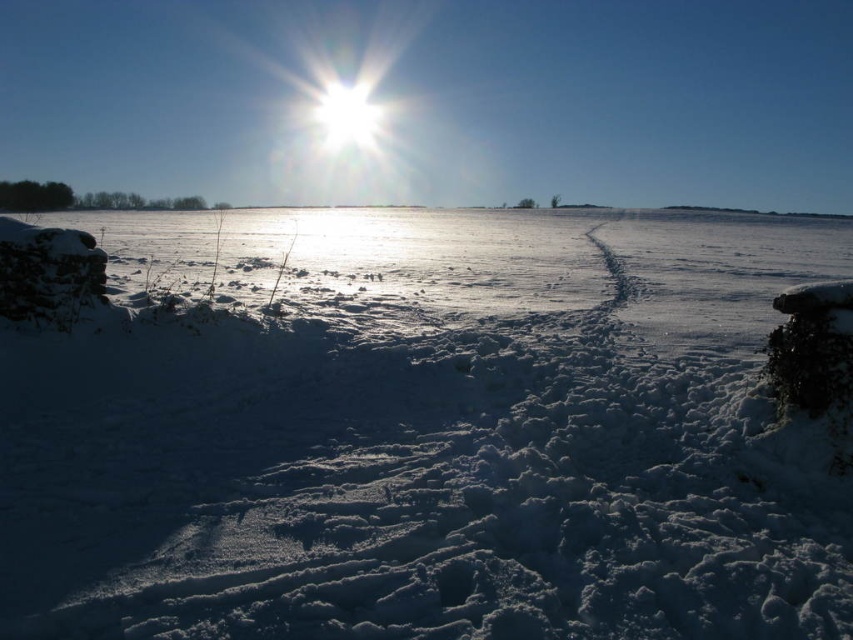
Question: Can you confirm if white fluffy snow at center is positioned to the left of white glossy sun at upper center?

Choices:
 (A) no
 (B) yes

Answer: (A)

Question: Can you confirm if white fluffy snow at center is positioned below white glossy sun at upper center?

Choices:
 (A) yes
 (B) no

Answer: (A)

Question: Among these points, which one is farthest from the camera?

Choices:
 (A) (747, 412)
 (B) (339, 125)

Answer: (B)

Question: Which point is farther from the camera taking this photo?

Choices:
 (A) (257, 525)
 (B) (337, 131)

Answer: (B)

Question: Can you confirm if white fluffy snow at center is thinner than white glossy sun at upper center?

Choices:
 (A) yes
 (B) no

Answer: (B)